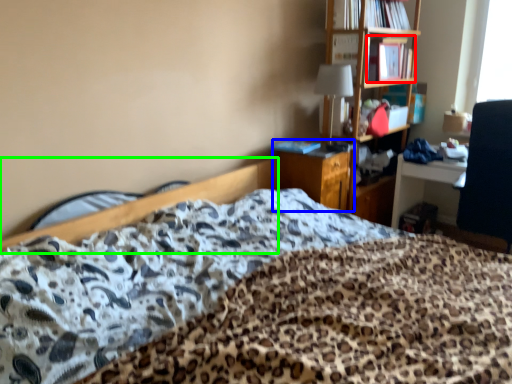
Question: Which object is positioned closest to book (highlighted by a red box)? Select from file cabinet (highlighted by a blue box) and bed frame (highlighted by a green box).

Choices:
 (A) file cabinet
 (B) bed frame

Answer: (A)